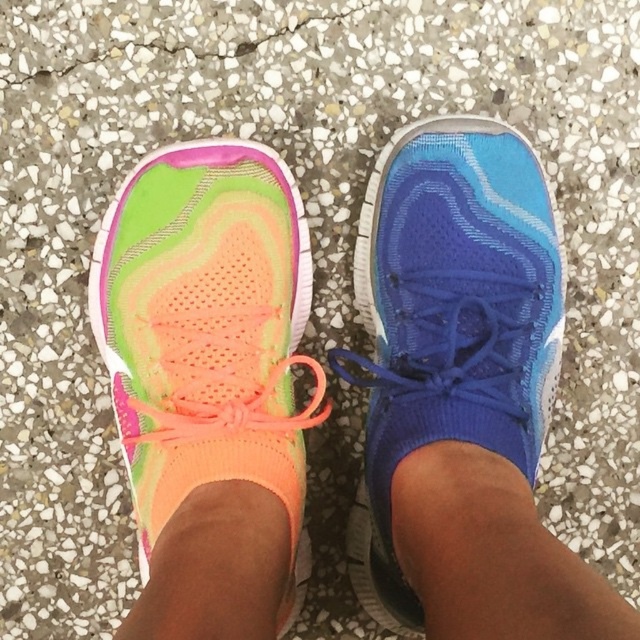
Is point (417, 259) farther from viewer compared to point (376, 209)?

No, it is in front of (376, 209).

Where is `neon mesh shoe at left`? neon mesh shoe at left is located at coordinates (467, 388).

Find the location of a particular element. neon mesh shoe at left is located at coordinates (467, 388).

Find the location of a particular element. neon mesh shoe at left is located at coordinates (467, 388).

Who is more distant from viewer, (x=440, y=605) or (x=307, y=284)?

Positioned behind is point (x=307, y=284).

Between point (436, 556) and point (193, 256), which one is positioned behind?

Positioned behind is point (193, 256).

At what (x,y) coordinates should I click in order to perform the action: click on neon mesh shoe at left. Please return your answer as a coordinate pair (x, y). Looking at the image, I should click on (467, 388).

Does neon mesh shoe at center have a lesser width compared to blue mesh shoe at center?

Incorrect, neon mesh shoe at center's width is not less than blue mesh shoe at center's.

Which is behind, point (256, 365) or point (516, 196)?

The point (516, 196) is behind.

Who is more forward, (x=273, y=348) or (x=392, y=532)?

Point (x=392, y=532) is more forward.

This screenshot has width=640, height=640. I want to click on neon mesh shoe at center, so click(x=208, y=332).